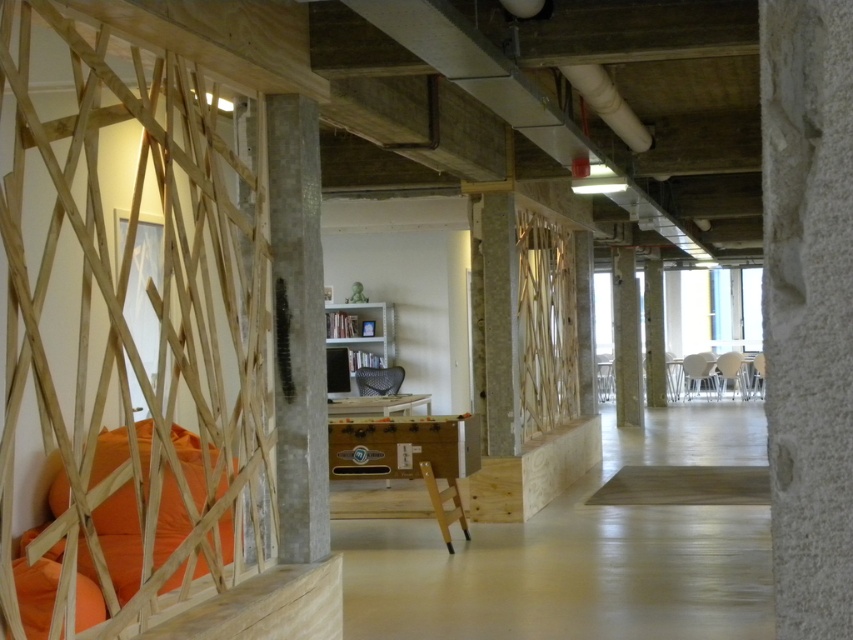
Describe the element at coordinates (117, 513) in the screenshot. I see `orange fabric pillow at left` at that location.

Measure the distance between point (x=120, y=454) and camera.

5.88 meters

The width and height of the screenshot is (853, 640). In order to click on orange fabric pillow at left in this screenshot , I will do `click(117, 513)`.

Does gray concrete pillar at center appear over smooth concrete pillar at center?

Yes, gray concrete pillar at center is above smooth concrete pillar at center.

Is gray concrete pillar at center below smooth concrete pillar at center?

No.

This screenshot has height=640, width=853. What are the coordinates of `gray concrete pillar at center` in the screenshot? It's located at (297, 326).

Where is `gray concrete pillar at center`? The height and width of the screenshot is (640, 853). gray concrete pillar at center is located at coordinates (297, 326).

Can you confirm if gray concrete pillar at center is smaller than concrete column at center?

Yes, gray concrete pillar at center is smaller than concrete column at center.

Does gray concrete pillar at center come in front of concrete column at center?

Yes, gray concrete pillar at center is in front of concrete column at center.

Is point (308, 328) more distant than point (628, 349)?

No, it is not.

Locate an element on the screen. gray concrete pillar at center is located at coordinates [x=297, y=326].